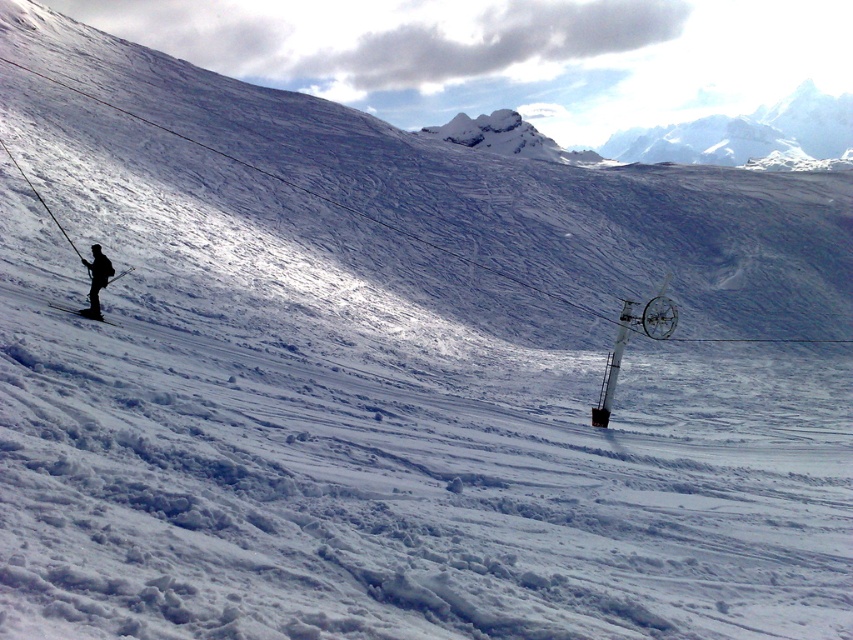
Question: Observing the image, what is the correct spatial positioning of white plastic ski lift at right in reference to black matte skier at left?

Choices:
 (A) right
 (B) left

Answer: (A)

Question: Which object is positioned farthest from the black matte ski at lower left?

Choices:
 (A) black matte skier at left
 (B) white plastic ski lift at right

Answer: (B)

Question: Which point is farther to the camera?

Choices:
 (A) black matte ski at lower left
 (B) black matte skier at left

Answer: (B)

Question: Is white plastic ski lift at right wider than black matte skier at left?

Choices:
 (A) no
 (B) yes

Answer: (B)

Question: Can you confirm if white plastic ski lift at right is positioned to the right of black matte skier at left?

Choices:
 (A) no
 (B) yes

Answer: (B)

Question: Which object appears closest to the camera in this image?

Choices:
 (A) black matte skier at left
 (B) white plastic ski lift at right

Answer: (A)